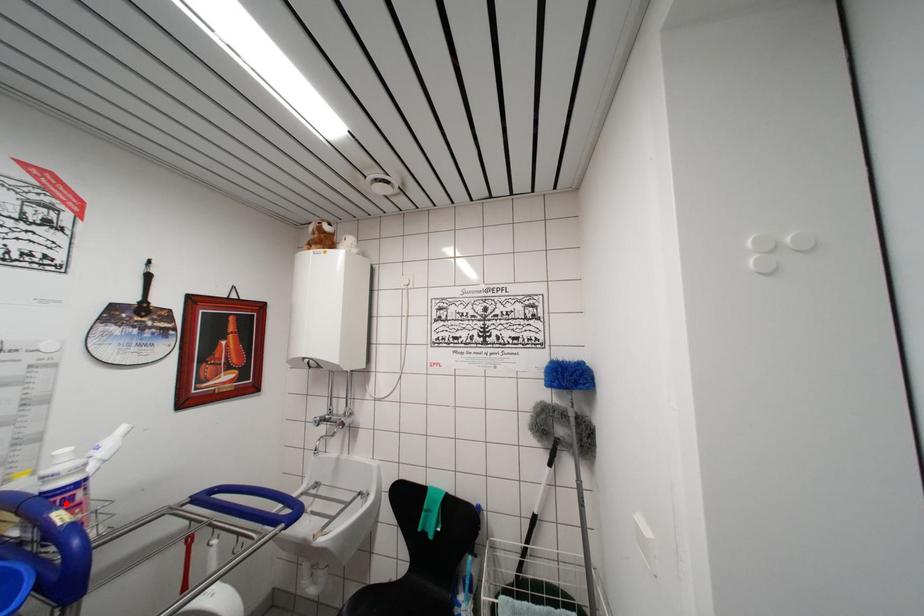
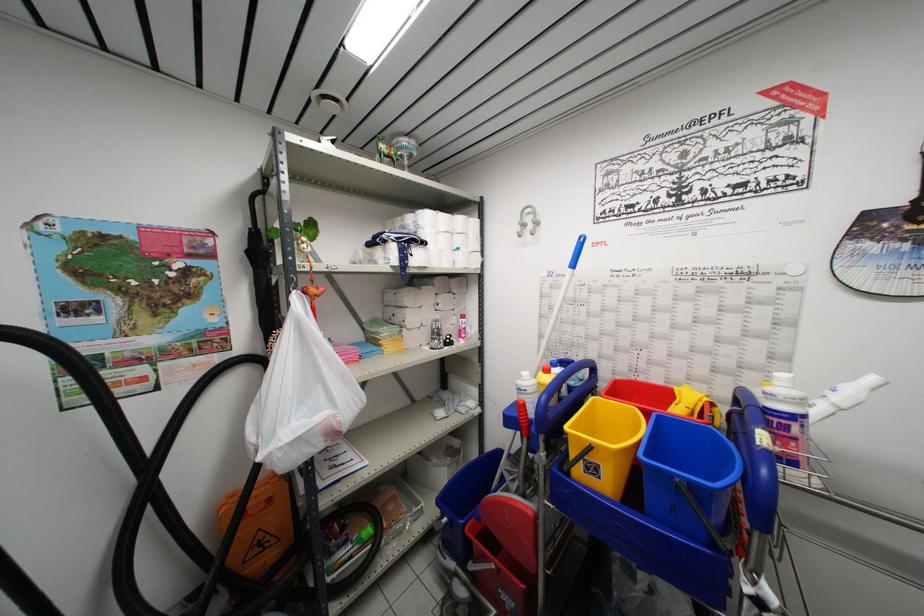
In the second image, find the point that corresponds to the highlighted location in the first image.

(783, 428)